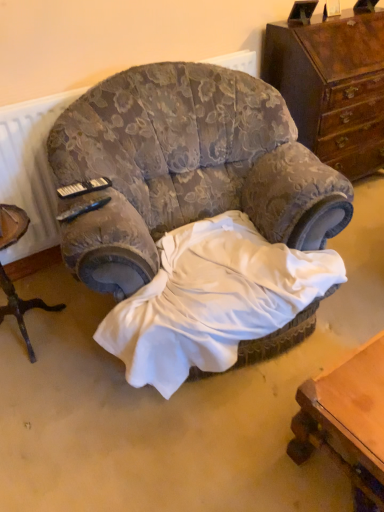
I want to click on velvet floral armchair at center, so click(x=186, y=168).

Locate an element on the screen. The width and height of the screenshot is (384, 512). wooden tripod table at left is located at coordinates (21, 308).

Is white satin sheet at center inside or outside of wooden chest of drawers at upper right?

white satin sheet at center is not inside wooden chest of drawers at upper right, it's outside.

From the image's perspective, does white satin sheet at center appear higher than wooden chest of drawers at upper right?

Incorrect, from the image's perspective, white satin sheet at center is lower than wooden chest of drawers at upper right.

Where is `the chest of drawers above the white satin sheet at center (from the image's perspective)`? This screenshot has width=384, height=512. the chest of drawers above the white satin sheet at center (from the image's perspective) is located at coordinates (333, 86).

Is white satin sheet at center far away from wooden chest of drawers at upper right?

white satin sheet at center is far away from wooden chest of drawers at upper right.

Is wooden chest of drawers at upper right to the left of velvet floral armchair at center from the viewer's perspective?

No, wooden chest of drawers at upper right is not to the left of velvet floral armchair at center.

Based on the photo, is wooden chest of drawers at upper right positioned far away from velvet floral armchair at center?

No, wooden chest of drawers at upper right is not far away from velvet floral armchair at center.

In the image, is wooden chest of drawers at upper right positioned in front of or behind velvet floral armchair at center?

In the image, wooden chest of drawers at upper right appears behind velvet floral armchair at center.

From the picture: From the image's perspective, which is below, wooden chest of drawers at upper right or velvet floral armchair at center?

velvet floral armchair at center.

Does wooden tripod table at left touch velvet floral armchair at center?

No.

Is the depth of wooden tripod table at left greater than that of velvet floral armchair at center?

Yes, the depth of wooden tripod table at left is greater than that of velvet floral armchair at center.

From the image's perspective, does wooden tripod table at left appear lower than velvet floral armchair at center?

Yes, from the image's perspective, wooden tripod table at left is beneath velvet floral armchair at center.

How many degrees apart are the facing directions of wooden tripod table at left and velvet floral armchair at center?

wooden tripod table at left and velvet floral armchair at center are facing 14.2 degrees away from each other.

Is velvet floral armchair at center far from wooden tripod table at left?

No, there isn't a large distance between velvet floral armchair at center and wooden tripod table at left.

Is point (98, 199) closer or farther from the camera than point (3, 238)?

Point (98, 199) is positioned closer to the camera compared to point (3, 238).

Based on the photo, from a real-world perspective, who is located higher, velvet floral armchair at center or wooden tripod table at left?

From a 3D spatial view, velvet floral armchair at center is above.

Based on their sizes in the image, would you say velvet floral armchair at center is bigger or smaller than wooden tripod table at left?

Clearly, velvet floral armchair at center is larger in size than wooden tripod table at left.

Does point (226, 167) come in front of point (309, 59)?

That is True.

What's the angular difference between velvet floral armchair at center and wooden chest of drawers at upper right's facing directions?

13.9 degrees separate the facing orientations of velvet floral armchair at center and wooden chest of drawers at upper right.

Are velvet floral armchair at center and wooden chest of drawers at upper right beside each other?

No, velvet floral armchair at center is not touching wooden chest of drawers at upper right.

Could you tell me if velvet floral armchair at center is turned towards wooden chest of drawers at upper right?

No, velvet floral armchair at center is not turned towards wooden chest of drawers at upper right.

From the image's perspective, which is above, wooden tripod table at left or wooden chest of drawers at upper right?

From the image's view, wooden chest of drawers at upper right is above.

What's the angular difference between wooden tripod table at left and wooden chest of drawers at upper right's facing directions?

The facing directions of wooden tripod table at left and wooden chest of drawers at upper right are 0.311 degrees apart.

From a real-world perspective, is wooden tripod table at left on wooden chest of drawers at upper right?

No.

Does wooden tripod table at left have a greater height compared to wooden chest of drawers at upper right?

Incorrect, the height of wooden tripod table at left is not larger of that of wooden chest of drawers at upper right.

Is the surface of velvet floral armchair at center in direct contact with white satin sheet at center?

They are not placed beside each other.

How many degrees apart are the facing directions of velvet floral armchair at center and white satin sheet at center?

The angle between the facing direction of velvet floral armchair at center and the facing direction of white satin sheet at center is 2.14 degrees.

From a real-world perspective, is velvet floral armchair at center under white satin sheet at center?

Actually, velvet floral armchair at center is physically above white satin sheet at center in the real world.

Is point (116, 275) more distant than point (184, 311)?

Yes, point (116, 275) is farther from viewer.

Image resolution: width=384 pixels, height=512 pixels. I want to click on sheet below the wooden chest of drawers at upper right (from a real-world perspective), so click(x=212, y=300).

The width and height of the screenshot is (384, 512). Identify the location of chest of drawers on the right of velvet floral armchair at center. (333, 86).

From the image, which object appears to be farther from wooden chest of drawers at upper right, white satin sheet at center or velvet floral armchair at center?

white satin sheet at center is positioned further to the anchor wooden chest of drawers at upper right.

Looking at the image, which one is located closer to white satin sheet at center, wooden chest of drawers at upper right or wooden tripod table at left?

wooden tripod table at left is closer to white satin sheet at center.

Looking at this image, considering their positions, is wooden tripod table at left positioned further to velvet floral armchair at center than white satin sheet at center?

wooden tripod table at left is further to velvet floral armchair at center.

Which object lies nearer to the anchor point wooden chest of drawers at upper right, velvet floral armchair at center or wooden tripod table at left?

velvet floral armchair at center.

Estimate the real-world distances between objects in this image. Which object is closer to wooden tripod table at left, white satin sheet at center or velvet floral armchair at center?

white satin sheet at center lies closer to wooden tripod table at left than the other object.

Looking at the image, which one is located closer to wooden tripod table at left, velvet floral armchair at center or white satin sheet at center?

white satin sheet at center is closer to wooden tripod table at left.

Looking at the image, which one is located closer to velvet floral armchair at center, wooden chest of drawers at upper right or white satin sheet at center?

Among the two, white satin sheet at center is located nearer to velvet floral armchair at center.

In the scene shown: Looking at the image, which one is located further to wooden tripod table at left, wooden chest of drawers at upper right or velvet floral armchair at center?

Among the two, wooden chest of drawers at upper right is located further to wooden tripod table at left.

I want to click on sheet between velvet floral armchair at center and wooden chest of drawers at upper right from front to back, so click(x=212, y=300).

At what (x,y) coordinates should I click in order to perform the action: click on chair between wooden tripod table at left and white satin sheet at center. Please return your answer as a coordinate pair (x, y). Looking at the image, I should click on (186, 168).

Identify the location of sheet situated between wooden tripod table at left and wooden chest of drawers at upper right from left to right. The image size is (384, 512). (212, 300).

Where is `chair located between wooden tripod table at left and wooden chest of drawers at upper right in the left-right direction`? chair located between wooden tripod table at left and wooden chest of drawers at upper right in the left-right direction is located at coordinates (186, 168).